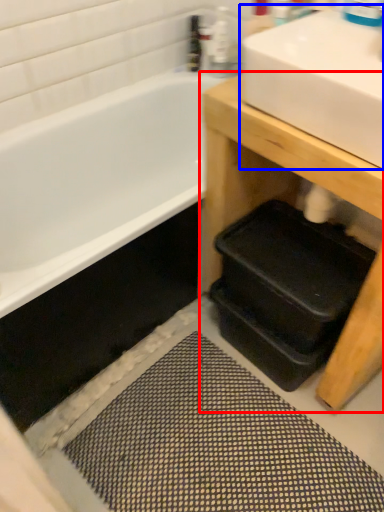
Question: Which point is closer to the camera, table (highlighted by a red box) or sink (highlighted by a blue box)?

Choices:
 (A) table
 (B) sink

Answer: (B)